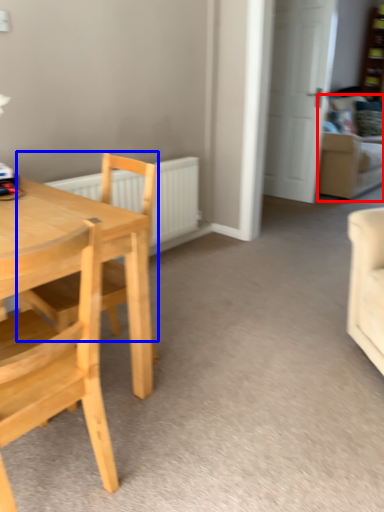
Question: Which of the following is the closest to the observer, couch (highlighted by a red box) or chair (highlighted by a blue box)?

Choices:
 (A) couch
 (B) chair

Answer: (B)